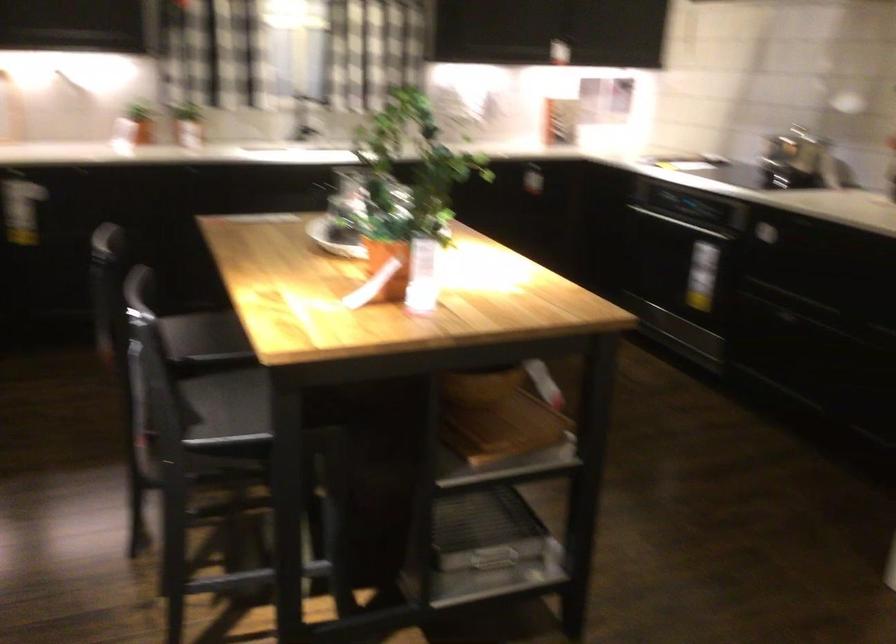
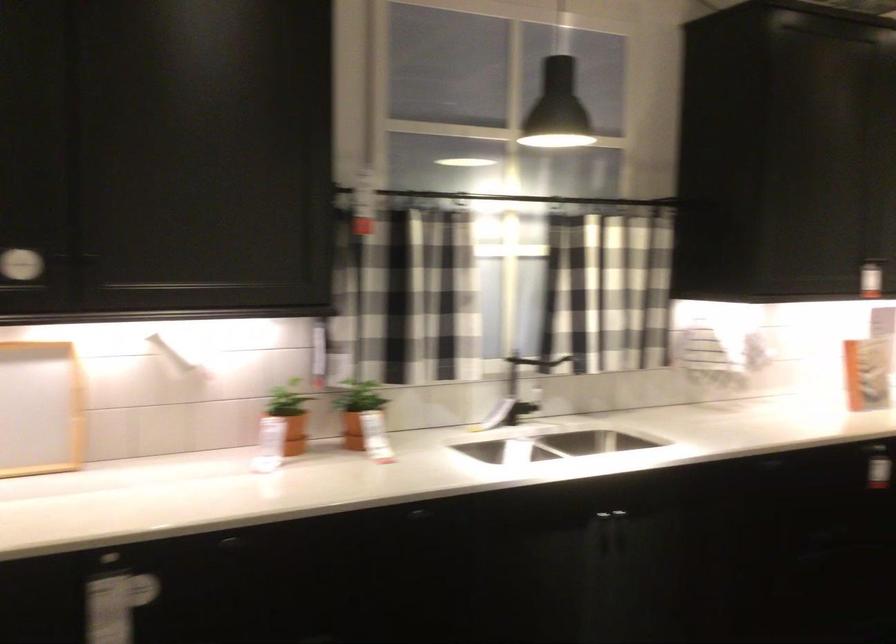
What movement of the cameraman would produce the second image?

The cameraman walked toward left, forward.